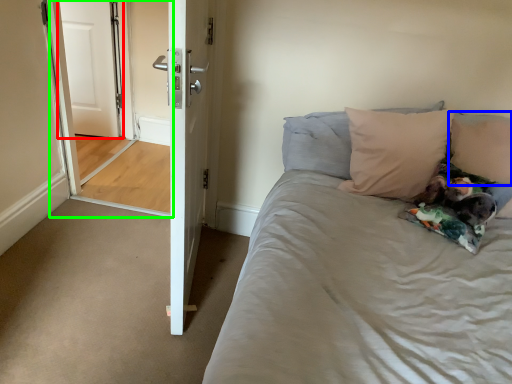
Question: Based on their relative distances, which object is nearer to door (highlighted by a red box)? Choose from pillow (highlighted by a blue box) and screen door (highlighted by a green box).

Choices:
 (A) pillow
 (B) screen door

Answer: (B)